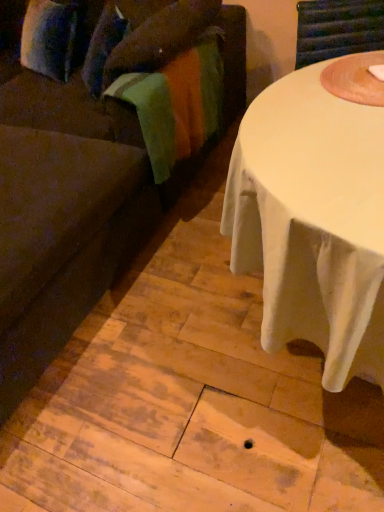
The width and height of the screenshot is (384, 512). Describe the element at coordinates (65, 216) in the screenshot. I see `brown fabric couch at left` at that location.

The width and height of the screenshot is (384, 512). Identify the location of brown fabric couch at left. (65, 216).

Looking at this image, what is the approximate width of brown fabric couch at left?

brown fabric couch at left is 8.19 feet wide.

Describe the element at coordinates (176, 105) in the screenshot. I see `velvety green blanket at left` at that location.

This screenshot has height=512, width=384. Find the location of `velvety green blanket at left`. velvety green blanket at left is located at coordinates (176, 105).

Where is `brown fabric couch at left`? The height and width of the screenshot is (512, 384). brown fabric couch at left is located at coordinates (65, 216).

Is brown fabric couch at left at the left side of velvety green blanket at left?

Correct, you'll find brown fabric couch at left to the left of velvety green blanket at left.

Based on the photo, is the position of brown fabric couch at left less distant than that of velvety green blanket at left?

Yes.

Is point (243, 100) positioned behind point (155, 81)?

Yes.

From the image's perspective, is brown fabric couch at left located above or below velvety green blanket at left?

Clearly, from the image's perspective, brown fabric couch at left is below velvety green blanket at left.

From a real-world perspective, is brown fabric couch at left above or below velvety green blanket at left?

brown fabric couch at left is above velvety green blanket at left.

Does brown fabric couch at left have a greater width compared to velvety green blanket at left?

Yes, brown fabric couch at left is wider than velvety green blanket at left.

Looking at this image, considering the sizes of brown fabric couch at left and velvety green blanket at left in the image, is brown fabric couch at left taller or shorter than velvety green blanket at left?

Considering their sizes, brown fabric couch at left has more height than velvety green blanket at left.

Can you confirm if brown fabric couch at left is smaller than velvety green blanket at left?

No.

Do you think brown fabric couch at left is within velvety green blanket at left, or outside of it?

brown fabric couch at left is located beyond the bounds of velvety green blanket at left.

Is brown fabric couch at left far from velvety green blanket at left?

No, brown fabric couch at left is not far from velvety green blanket at left.

Could you tell me if brown fabric couch at left is facing velvety green blanket at left?

No, brown fabric couch at left is not turned towards velvety green blanket at left.

Measure the distance between brown fabric couch at left and velvety green blanket at left.

A distance of 13.17 inches exists between brown fabric couch at left and velvety green blanket at left.

Locate an element on the screen. blanket above the brown fabric couch at left (from the image's perspective) is located at coordinates (176, 105).

Is velvety green blanket at left to the left or to the right of brown fabric couch at left in the image?

velvety green blanket at left is to the right of brown fabric couch at left.

From the picture: Does velvety green blanket at left come in front of brown fabric couch at left?

No, it is not.

Considering the positions of point (134, 77) and point (122, 202), is point (134, 77) closer or farther from the camera than point (122, 202)?

Point (134, 77) is positioned farther from the camera compared to point (122, 202).

From the image's perspective, between velvety green blanket at left and brown fabric couch at left, who is located below?

From the image's view, brown fabric couch at left is below.

From a real-world perspective, who is located lower, velvety green blanket at left or brown fabric couch at left?

velvety green blanket at left, from a real-world perspective.

Between velvety green blanket at left and brown fabric couch at left, which one has smaller width?

velvety green blanket at left is thinner.

Can you confirm if velvety green blanket at left is taller than brown fabric couch at left?

No, velvety green blanket at left is not taller than brown fabric couch at left.

From the picture: Which of these two, velvety green blanket at left or brown fabric couch at left, is smaller?

With smaller size is velvety green blanket at left.

Consider the image. Is velvety green blanket at left surrounding brown fabric couch at left?

No, brown fabric couch at left is not surrounded by velvety green blanket at left.

Is velvety green blanket at left far away from brown fabric couch at left?

velvety green blanket at left is actually quite close to brown fabric couch at left.

Is velvety green blanket at left oriented towards brown fabric couch at left?

Yes, velvety green blanket at left faces towards brown fabric couch at left.

How many degrees apart are the facing directions of velvety green blanket at left and brown fabric couch at left?

velvety green blanket at left and brown fabric couch at left are facing 1.71 degrees away from each other.

How distant is velvety green blanket at left from brown fabric couch at left?

velvety green blanket at left is 33.46 centimeters from brown fabric couch at left.

The image size is (384, 512). In order to click on studio couch above the velvety green blanket at left (from a real-world perspective) in this screenshot , I will do `click(65, 216)`.

The width and height of the screenshot is (384, 512). In order to click on studio couch below the velvety green blanket at left (from the image's perspective) in this screenshot , I will do `click(65, 216)`.

The height and width of the screenshot is (512, 384). Identify the location of blanket lying above the brown fabric couch at left (from the image's perspective). (176, 105).